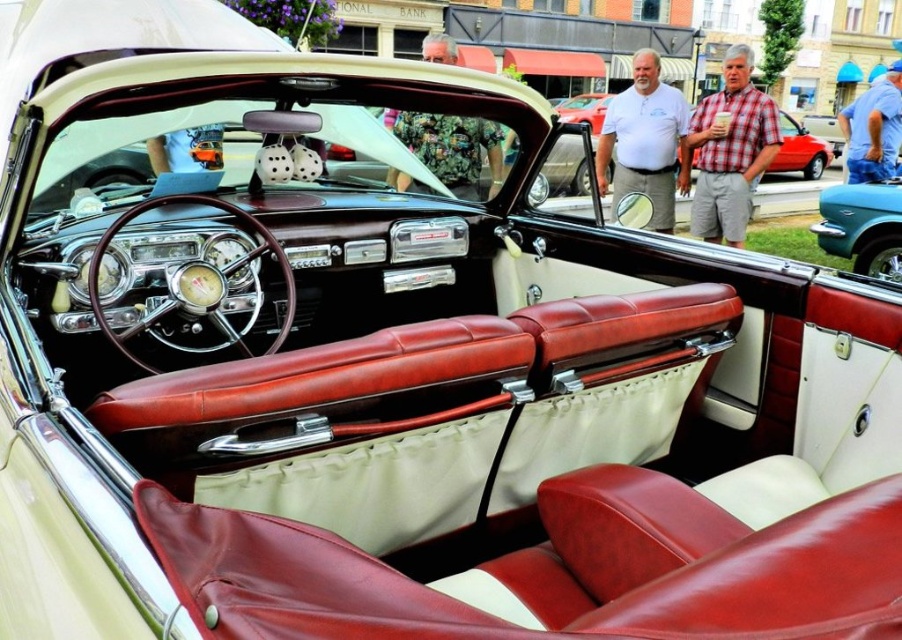
You are sitting in the vintage convertible car and want to reach both the point at coordinates point (x=701, y=164) and point (x=875, y=241). Which point will you reach first?

You will reach point (x=701, y=164) first because it is closer to you than point (x=875, y=241).

Consider the image. You are sitting in the vintage convertible car and notice a white cotton shirt at center and a matte red leather car at center. Which object is located to the left of the other?

The white cotton shirt at center is positioned on the left side of matte red leather car at center.

From the picture: You are a photographer setting up a shoot inside the vintage convertible car. You have two items to place in the scene for the photo shoot. The items are a plaid shirt at upper right and a teal metallic car at right. Given their sizes, which item will require more space in the car interior?

The teal metallic car at right requires more space because the plaid shirt at upper right occupies less space than teal metallic car at right.